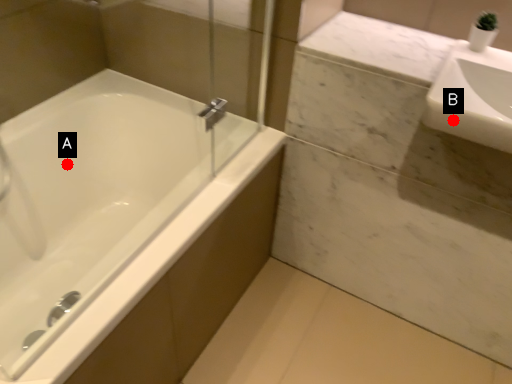
Question: Two points are circled on the image, labeled by A and B beside each circle. Which point is closer to the camera taking this photo?

Choices:
 (A) A is closer
 (B) B is closer

Answer: (B)